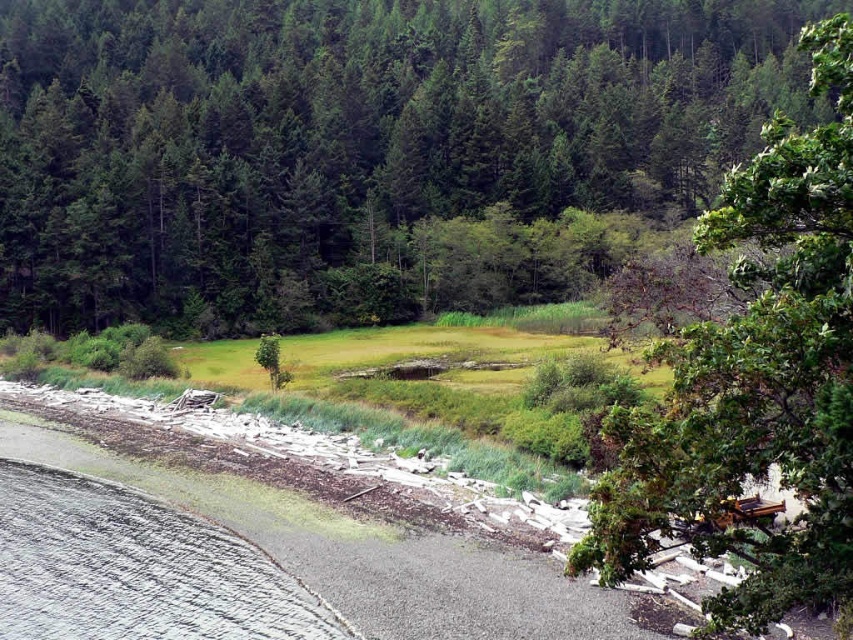
Looking at this image, you are standing at the shoreline with gravelly and sandy textures. You want to walk towards the green leafy tree at center. Which direction should you head?

The green leafy tree at center is located at point 0.205 on the x and 0.410 on the y coordinate. Since you are at the shoreline, which is likely at the bottom of the image, you should head upwards and slightly to the left to reach the green leafy tree at center.

You are standing on the shoreline and want to walk towards both the green leafy tree at center and the green leafy tree at upper right. Which tree will you reach first?

You will reach the green leafy tree at center first because it is closer to you than the green leafy tree at upper right, which is further away.

You are standing at the shoreline and want to walk towards the green leafy tree at center and the green leafy tree at upper right. Which tree should you head towards if you want to reach the one that is positioned to the left of the other?

You should head towards the green leafy tree at center because it is positioned to the left of the green leafy tree at upper right.